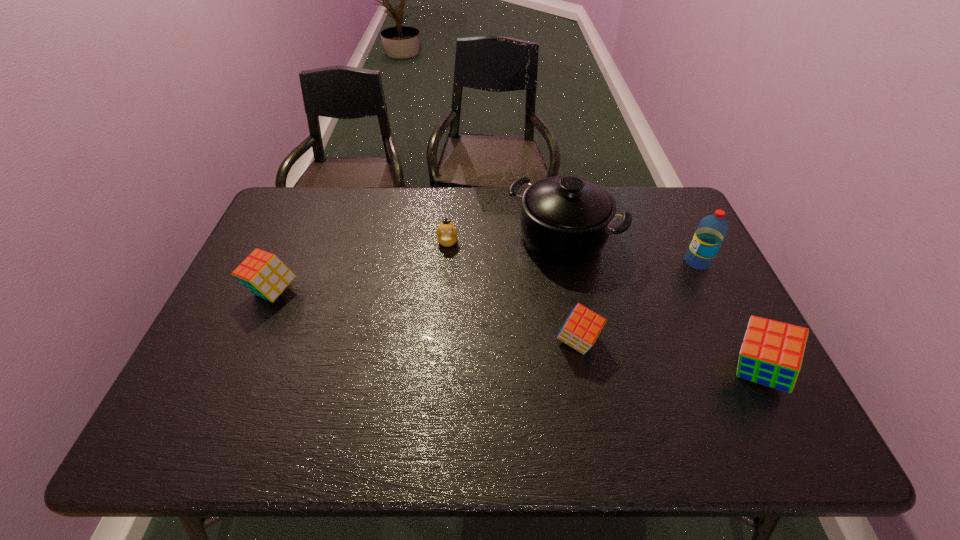
Identify the location of water bottle that is at the right edge. The height and width of the screenshot is (540, 960). (712, 229).

What are the coordinates of `object located in the near right corner section of the desktop` in the screenshot? It's located at (771, 354).

The height and width of the screenshot is (540, 960). Find the location of `vacant space at the far edge of the desktop`. vacant space at the far edge of the desktop is located at coordinates (341, 200).

In the image, there is a desktop. Identify the location of blank space at the right edge. (688, 247).

Where is `free space that is in between the rightmost cube and the water bottle`? This screenshot has height=540, width=960. free space that is in between the rightmost cube and the water bottle is located at coordinates point(727,317).

The image size is (960, 540). I want to click on vacant space that is in between the water bottle and the second cube from left to right, so click(637, 302).

In order to click on vacant space that's between the rightmost cube and the saucepan in this screenshot , I will do `click(660, 306)`.

Locate an element on the screen. Image resolution: width=960 pixels, height=540 pixels. vacant point located between the fifth object from right to left and the shortest cube is located at coordinates (513, 292).

Identify the location of free point between the duckling and the rightmost cube. coord(602,307).

At what (x,y) coordinates should I click in order to perform the action: click on empty space that is in between the second shortest cube and the rightmost cube. Please return your answer as a coordinate pair (x, y). This screenshot has width=960, height=540. Looking at the image, I should click on tap(515, 332).